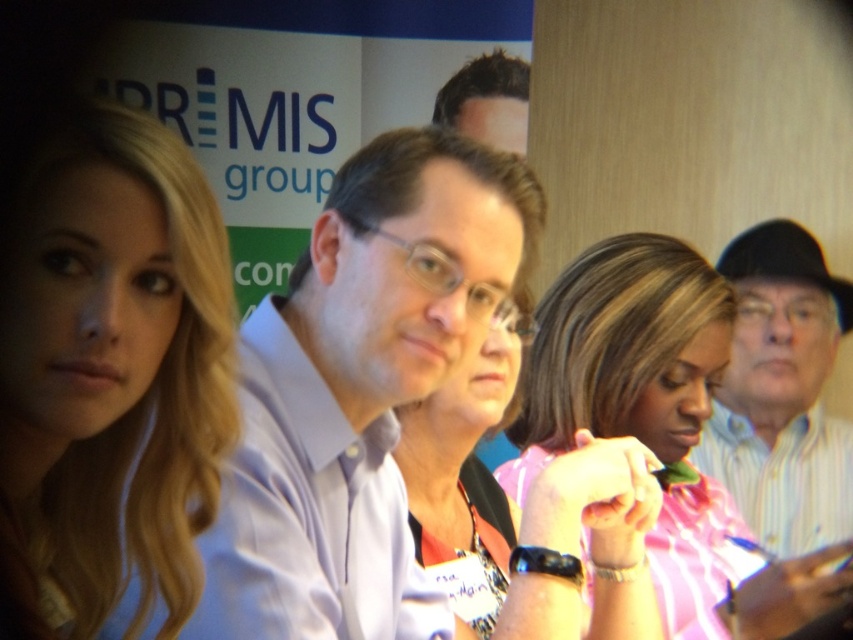
Question: Does white striped shirt at right have a larger size compared to matte black watch at center?

Choices:
 (A) no
 (B) yes

Answer: (B)

Question: Estimate the real-world distances between objects in this image. Which object is closer to the matte black watch at center?

Choices:
 (A) blonde hair at left
 (B) white striped shirt at right

Answer: (A)

Question: Can you confirm if pink striped shirt at center is bigger than matte black watch at center?

Choices:
 (A) no
 (B) yes

Answer: (B)

Question: Considering the real-world distances, which object is farthest from the dark brown hair at upper center?

Choices:
 (A) pink striped shirt at center
 (B) blonde hair at left
 (C) light blue shirt at center

Answer: (B)

Question: Can you confirm if light blue shirt at center is positioned to the left of white striped shirt at right?

Choices:
 (A) no
 (B) yes

Answer: (B)

Question: Estimate the real-world distances between objects in this image. Which object is farther from the white striped shirt at right?

Choices:
 (A) light blue shirt at center
 (B) pink striped shirt at center
 (C) matte black watch at center

Answer: (A)